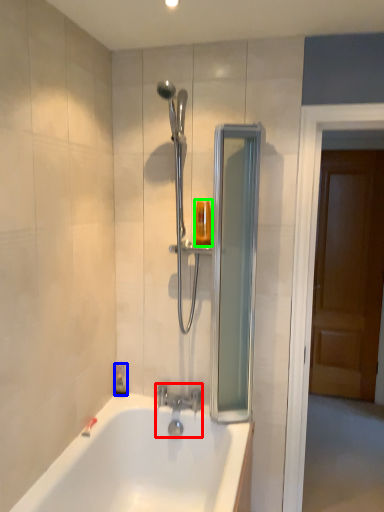
Question: Which object is the closest to the tap (highlighted by a red box)? Choose among these: soap dispenser (highlighted by a blue box) or toiletry (highlighted by a green box).

Choices:
 (A) soap dispenser
 (B) toiletry

Answer: (A)